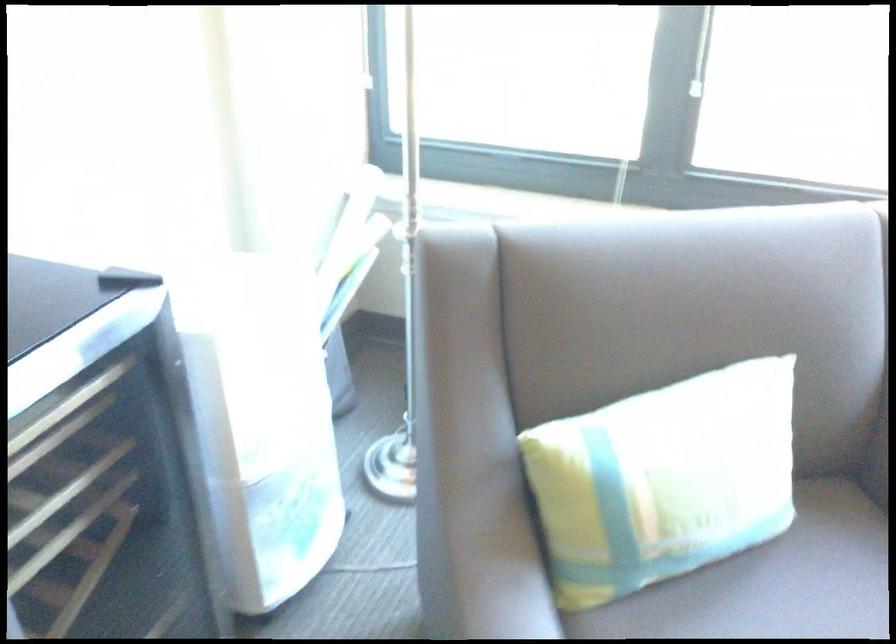
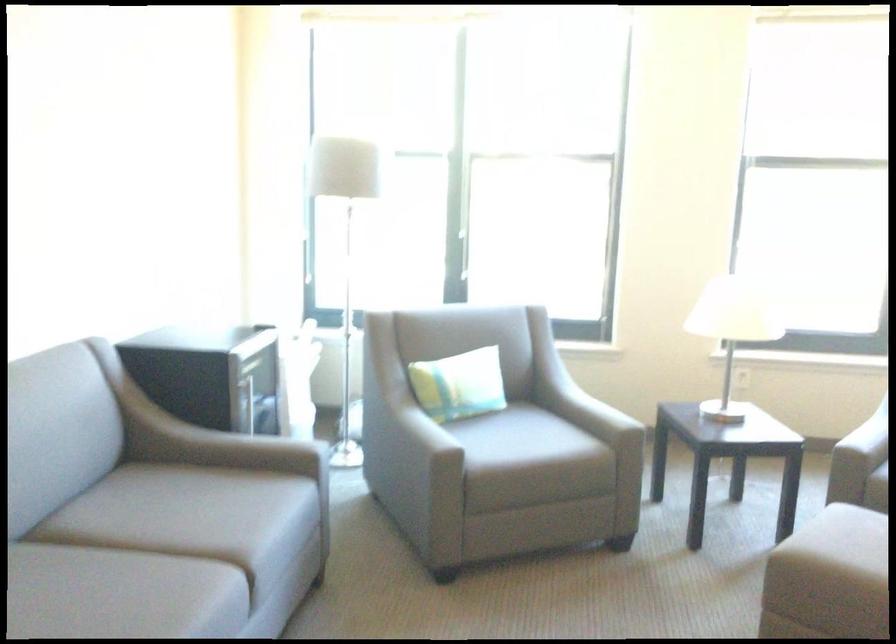
Find the pixel in the second image that matches pixel 506 524 in the first image.

(356, 420)